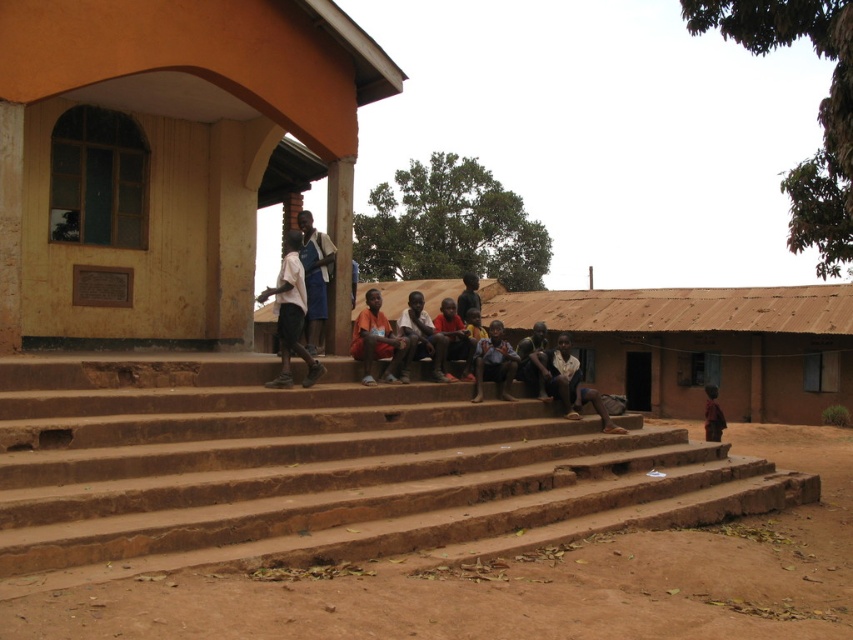
You are a photographer trying to capture a photo of the children on the steps. You notice the white fabric shirt at center and the brown fabric shirt at lower right. Which child should you focus on to ensure the subject is taller in the frame?

The white fabric shirt at center is taller than the brown fabric shirt at lower right, so focusing on the child wearing the white fabric shirt at center will ensure the subject is taller in the frame.

You are standing in front of the school building and see two points marked on the steps leading to the entrance. The first point is at coordinates point [555,378] and the second is at point [717,413]. Which point is closer to you?

Point [555,378] is closer to the viewer than point [717,413].